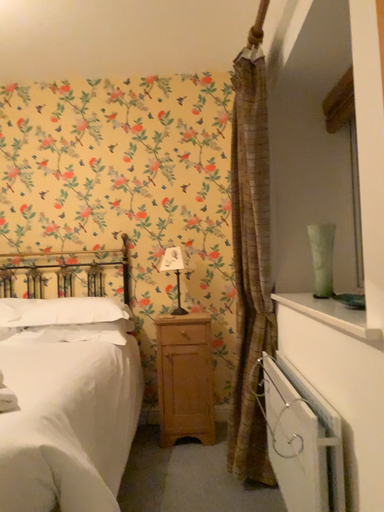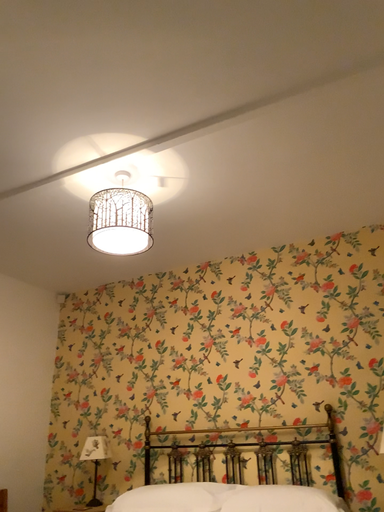
Question: How did the camera likely rotate when shooting the video?

Choices:
 (A) rotated left
 (B) rotated right

Answer: (A)